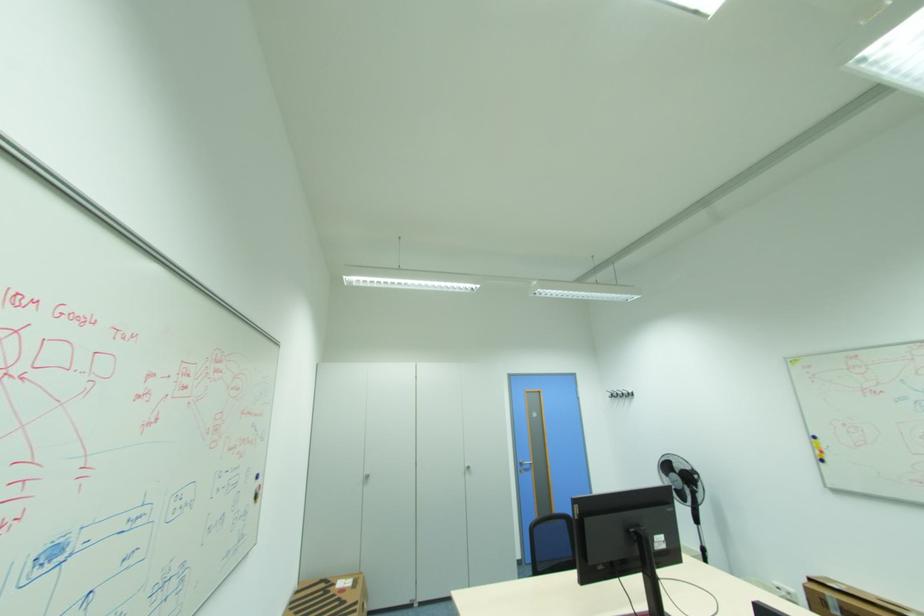
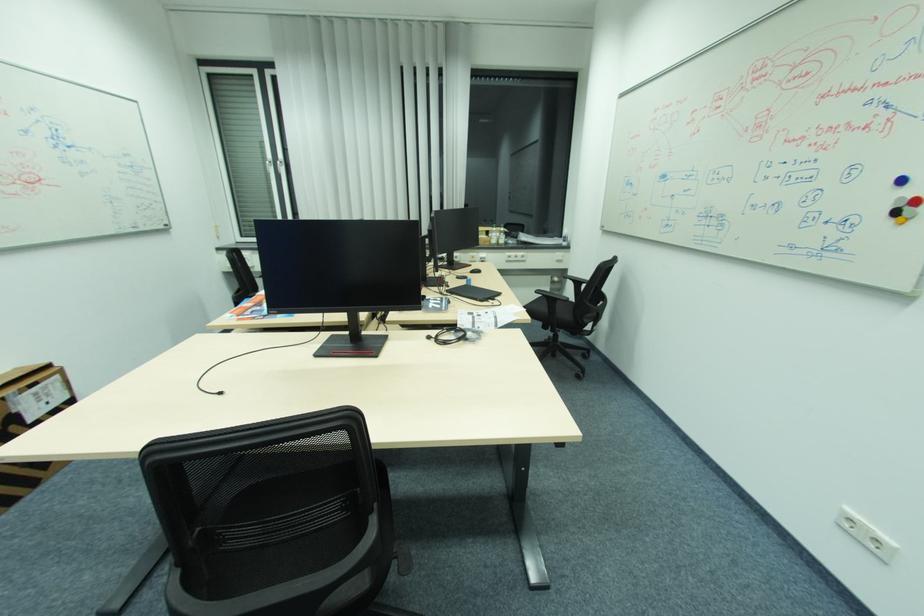
In the second image, find the point that corresponds to [263,477] in the first image.

(908, 180)